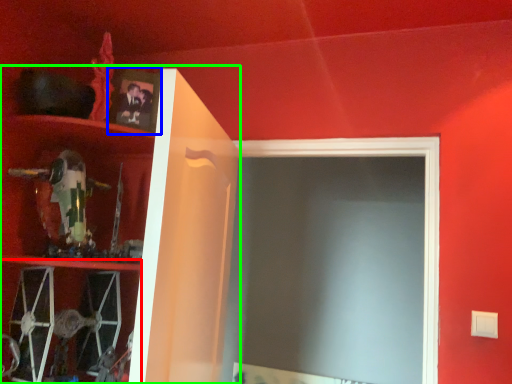
Question: Which is farther away from cabinet (highlighted by a red box)? picture frame (highlighted by a blue box) or cabinet (highlighted by a green box)?

Choices:
 (A) picture frame
 (B) cabinet

Answer: (A)